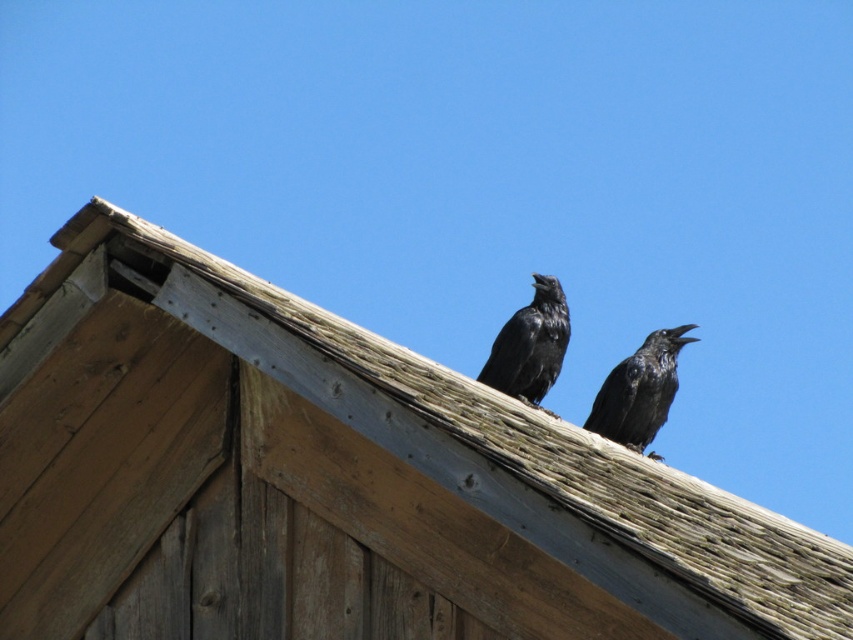
Question: Observing the image, what is the correct spatial positioning of shiny black raven at upper right in reference to shiny black raven at center?

Choices:
 (A) below
 (B) above

Answer: (A)

Question: Can you confirm if wooden shingles at upper center is thinner than shiny black raven at upper right?

Choices:
 (A) yes
 (B) no

Answer: (B)

Question: Which point is farther to the camera?

Choices:
 (A) shiny black raven at upper right
 (B) wooden shingles at upper center

Answer: (A)

Question: Which is nearer to the shiny black raven at center?

Choices:
 (A) shiny black raven at upper right
 (B) wooden shingles at upper center

Answer: (A)

Question: Is shiny black raven at upper right thinner than shiny black raven at center?

Choices:
 (A) no
 (B) yes

Answer: (A)

Question: Based on their relative distances, which object is nearer to the shiny black raven at upper right?

Choices:
 (A) wooden shingles at upper center
 (B) shiny black raven at center

Answer: (B)